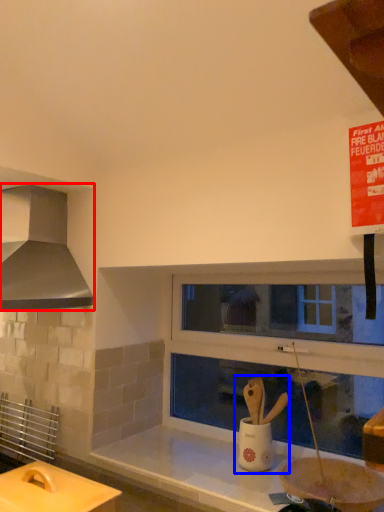
Question: Which object is further to the camera taking this photo, kitchen appliance (highlighted by a red box) or sink (highlighted by a blue box)?

Choices:
 (A) kitchen appliance
 (B) sink

Answer: (B)